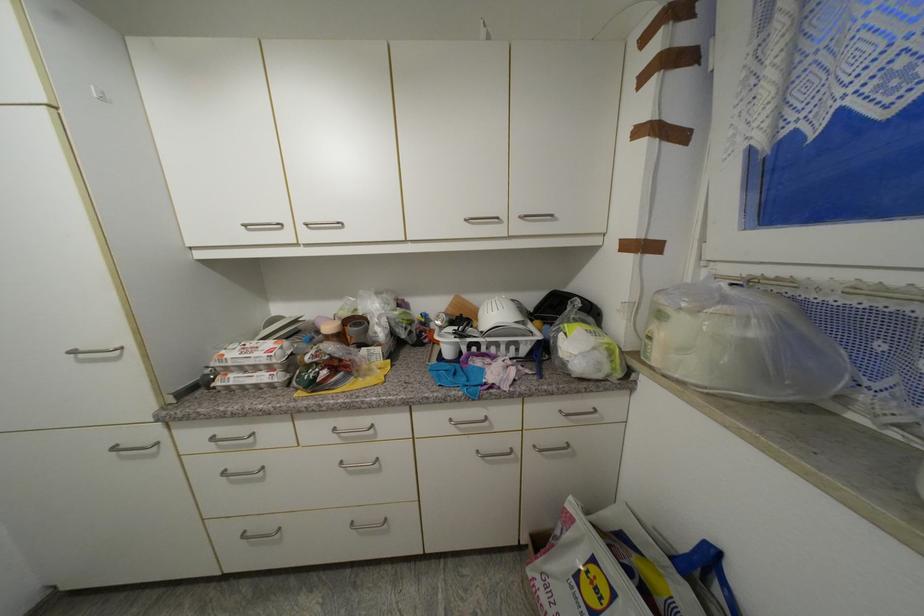
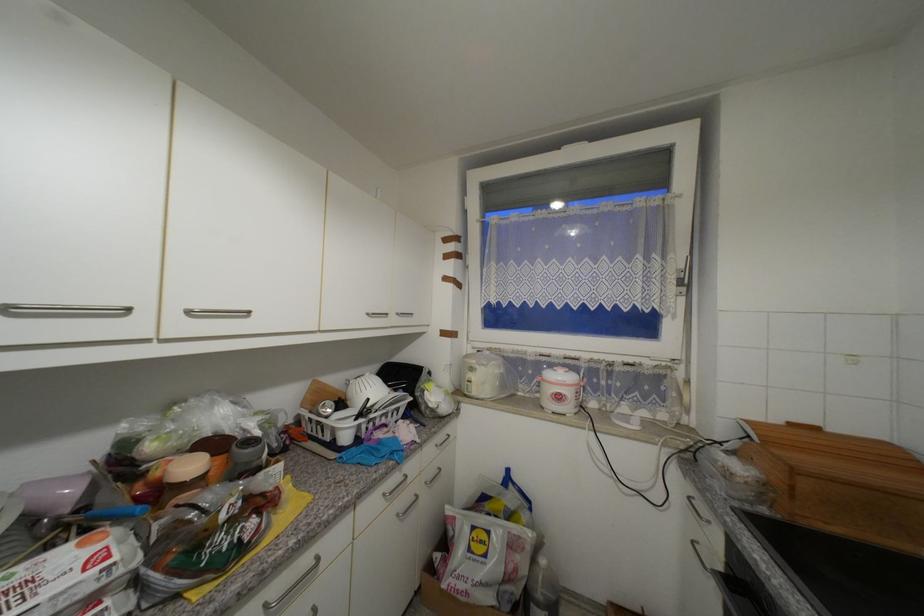
Question: Based on the continuous images, in which direction is the camera rotating? Reply with the corresponding letter.

Choices:
 (A) Left
 (B) Right
 (C) Up
 (D) Down

Answer: (B)